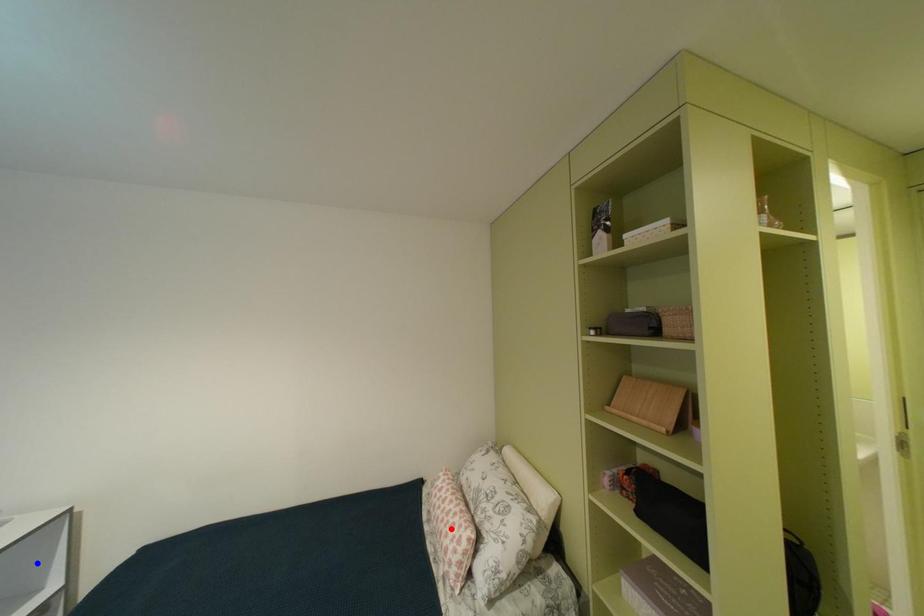
Question: In the image, two points are highlighted. Which point is nearer to the camera? Reply with the corresponding letter.

Choices:
 (A) blue point
 (B) red point

Answer: (A)